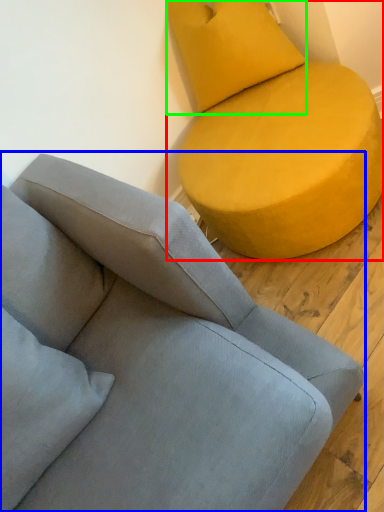
Question: Estimate the real-world distances between objects in this image. Which object is farther from studio couch (highlighted by a red box), studio couch (highlighted by a blue box) or pillow (highlighted by a green box)?

Choices:
 (A) studio couch
 (B) pillow

Answer: (A)